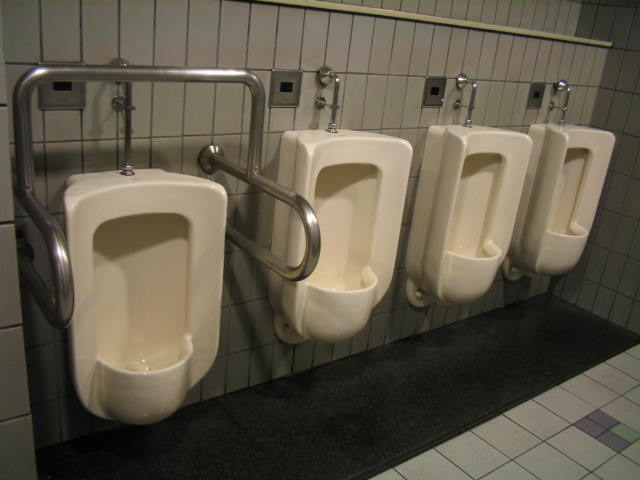
Image resolution: width=640 pixels, height=480 pixels. I want to click on urinals, so click(170, 255), click(364, 212), click(493, 199), click(555, 198).